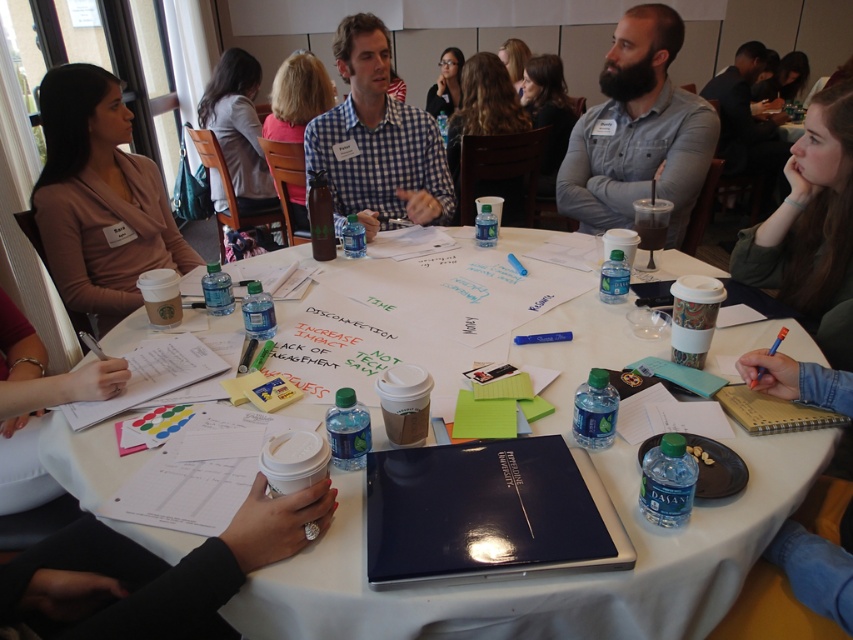
You are a tailor who needs to determine which item has a thicker fabric between the matte brown sweater at upper left and the checkered fabric shirt at center. Based on the description, which one should you choose for a winter coat lining?

The checkered fabric shirt at center is thicker than the matte brown sweater at upper left, so it would be more suitable for winter coat lining.

You are a tailor measuring the distance between two shirts on the table. The shirts are the gray denim shirt at upper right and the checkered fabric shirt at center. Can you fit a 25 inch long ruler between them?

The gray denim shirt at upper right and checkered fabric shirt at center are 27.19 inches apart, so yes, the 25 inch long ruler can fit between them since the distance is greater than the ruler length.

You are organizing a photoshoot and need to ensure that the checkered fabric shirt at center and the green matte jacket at upper right are visible in the frame. Given that the camera has a fixed focal length, which clothing item should you prioritize positioning closer to the camera to ensure both fit within the frame?

The checkered fabric shirt at center should be positioned closer to the camera since its width is larger than the green matte jacket at upper right, ensuring both fit within the frame.